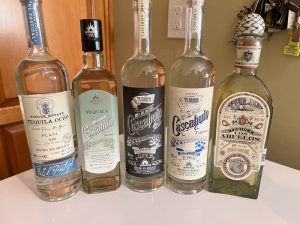
Locate an element on the screen. This screenshot has height=225, width=300. white outlet is located at coordinates (181, 33).